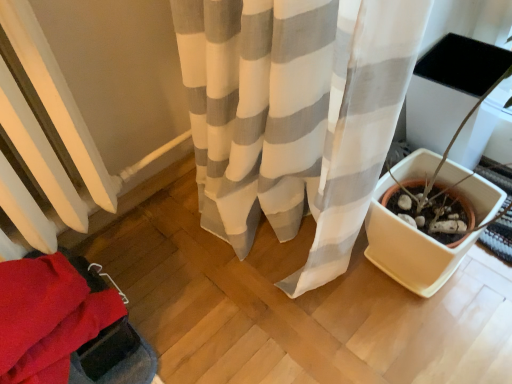
Image resolution: width=512 pixels, height=384 pixels. What are the coordinates of `white matte pot at right` in the screenshot? It's located at (440, 169).

What do you see at coordinates (440, 169) in the screenshot?
I see `white matte pot at right` at bounding box center [440, 169].

Identify the location of white matte pot at right. (440, 169).